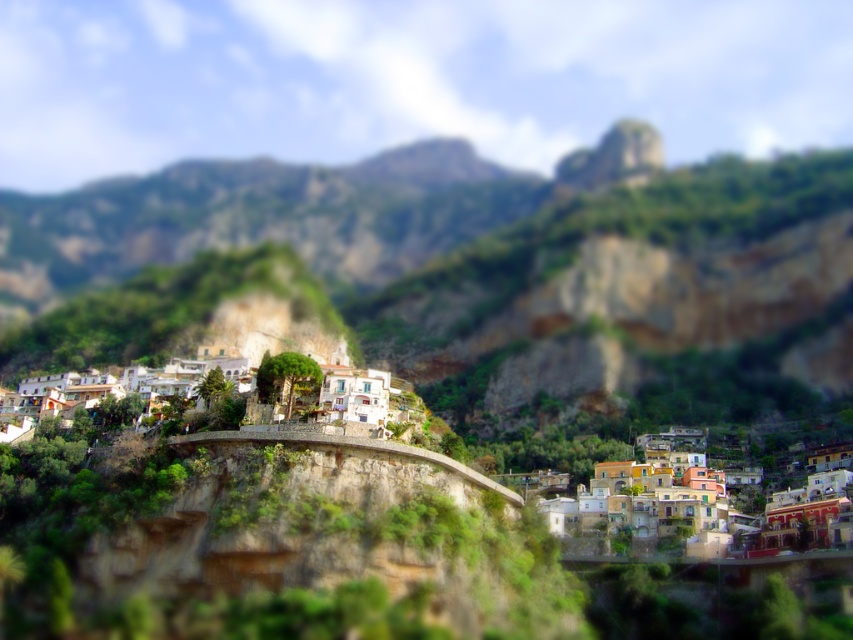
Does multicolored stone houses at lower right appear over white stucco houses at center?

No.

Describe the element at coordinates (640, 506) in the screenshot. The height and width of the screenshot is (640, 853). I see `multicolored stone houses at lower right` at that location.

The width and height of the screenshot is (853, 640). What are the coordinates of `multicolored stone houses at lower right` in the screenshot? It's located at (640, 506).

Which is more to the right, green rocky mountain at center or multicolored stone houses at lower right?

multicolored stone houses at lower right

Does green rocky mountain at center come in front of multicolored stone houses at lower right?

No, it is behind multicolored stone houses at lower right.

This screenshot has width=853, height=640. I want to click on green rocky mountain at center, so click(480, 241).

Does green rocky mountain at center have a greater height compared to white stucco houses at center?

Correct, green rocky mountain at center is much taller as white stucco houses at center.

Does green rocky mountain at center have a larger size compared to white stucco houses at center?

Correct, green rocky mountain at center is larger in size than white stucco houses at center.

What do you see at coordinates (480, 241) in the screenshot? I see `green rocky mountain at center` at bounding box center [480, 241].

At what (x,y) coordinates should I click in order to perform the action: click on green rocky mountain at center. Please return your answer as a coordinate pair (x, y). Looking at the image, I should click on (480, 241).